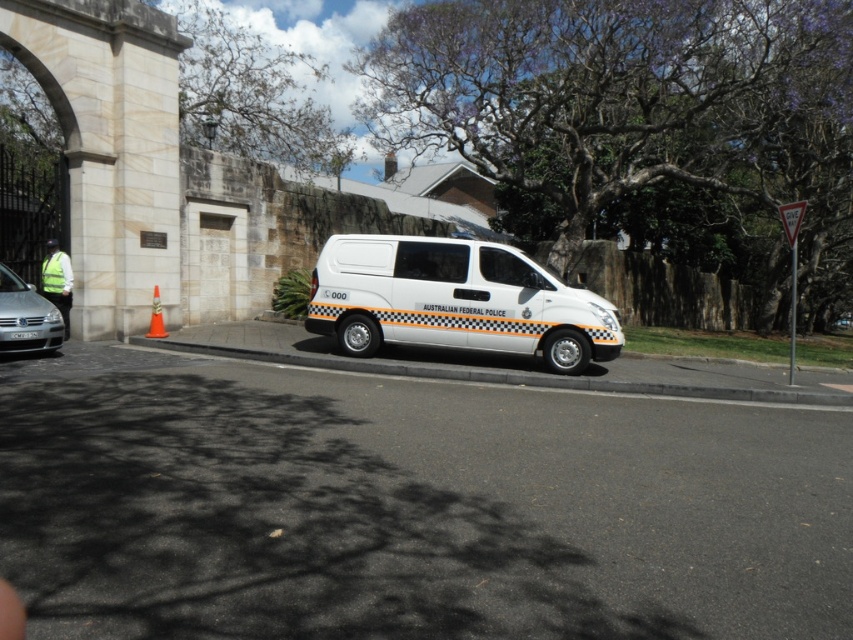
You are a pedestrian standing at the edge of the road. You see the white matte van at center and the white asphalt curb at lower center. Which object is closer to you?

The white asphalt curb at lower center is behind the white matte van at center, so the white matte van at center is closer to you.

Consider the image. You are driving a car and need to park near the white asphalt curb at lower center. However, there is a silver metallic sedan at lower left already parked there. Can you park your car next to the sedan without crossing the curb?

The white asphalt curb at lower center is located below the silver metallic sedan at lower left, which means the sedan is parked on the curb. Since parking on the curb is typically not allowed, you should look for another parking spot away from the curb to avoid illegal parking.